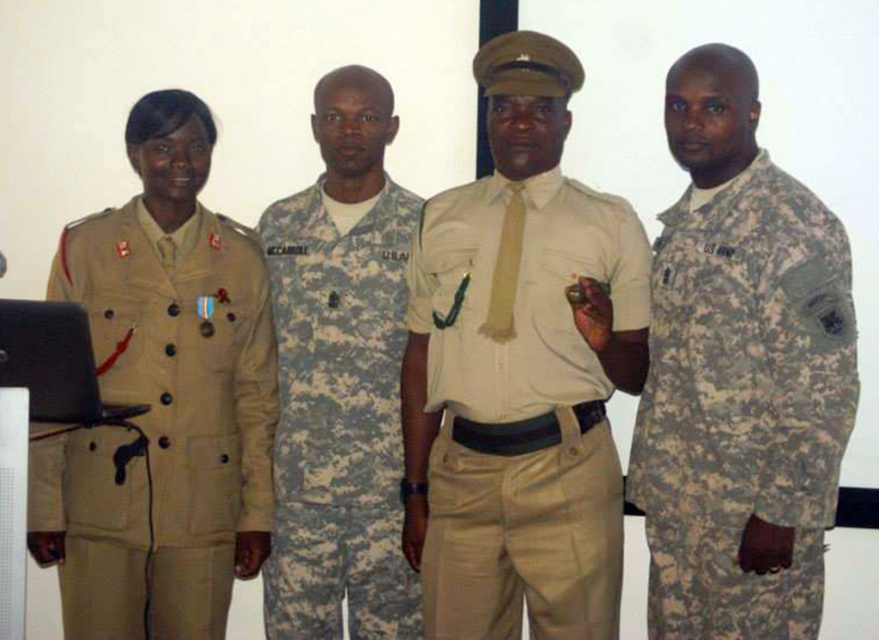
What do you see at coordinates (520, 372) in the screenshot?
I see `beige uniform at center` at bounding box center [520, 372].

Does beige uniform at center have a greater width compared to camouflage fabric uniform at right?

Yes.

Which is in front, point (469, 541) or point (812, 316)?

Positioned in front is point (812, 316).

At what (x,y) coordinates should I click in order to perform the action: click on beige uniform at center. Please return your answer as a coordinate pair (x, y). This screenshot has height=640, width=879. Looking at the image, I should click on (520, 372).

Is tan fabric uniform at left taller than digital camouflage uniform at center?

Incorrect, tan fabric uniform at left's height is not larger of digital camouflage uniform at center's.

Which is behind, point (209, 513) or point (381, 444)?

Positioned behind is point (381, 444).

Locate an element on the screen. The width and height of the screenshot is (879, 640). tan fabric uniform at left is located at coordinates (161, 426).

How far apart are beige uniform at center and tan fabric uniform at left?

beige uniform at center is 24.34 inches from tan fabric uniform at left.

At what (x,y) coordinates should I click in order to perform the action: click on beige uniform at center. Please return your answer as a coordinate pair (x, y). Looking at the image, I should click on (520, 372).

You are a GUI agent. You are given a task and a screenshot of the screen. Output one action in this format:
    pyautogui.click(x=<x>, y=<y>)
    Task: Click on the beige uniform at center
    
    Given the screenshot: What is the action you would take?
    pyautogui.click(x=520, y=372)

The image size is (879, 640). Identify the location of beige uniform at center. (520, 372).